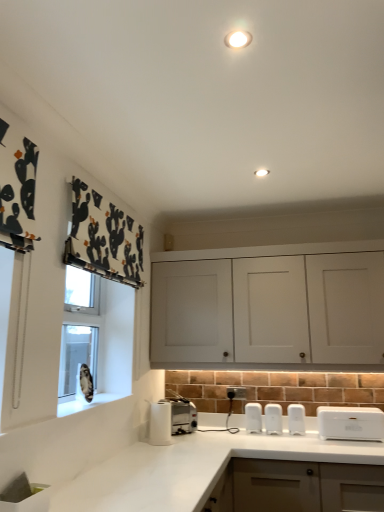
Question: Based on their sizes in the image, would you say white matte cabinet at center is bigger or smaller than white marble countertop at lower center?

Choices:
 (A) small
 (B) big

Answer: (A)

Question: Looking at their shapes, would you say white matte cabinet at center is wider or thinner than white marble countertop at lower center?

Choices:
 (A) thin
 (B) wide

Answer: (A)

Question: Is white matte cabinet at center to the left or to the right of white marble countertop at lower center in the image?

Choices:
 (A) right
 (B) left

Answer: (A)

Question: Is white marble countertop at lower center wider or thinner than white matte cabinet at center?

Choices:
 (A) thin
 (B) wide

Answer: (B)

Question: Is white marble countertop at lower center spatially inside white matte cabinet at center, or outside of it?

Choices:
 (A) outside
 (B) inside

Answer: (A)

Question: Based on their positions, is white marble countertop at lower center located to the left or right of white matte cabinet at center?

Choices:
 (A) left
 (B) right

Answer: (A)

Question: Looking at the image, does white marble countertop at lower center seem bigger or smaller compared to white matte cabinet at center?

Choices:
 (A) big
 (B) small

Answer: (A)